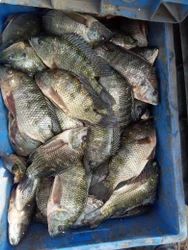
The image size is (188, 250). Identify the location of lid for bin. (143, 12).